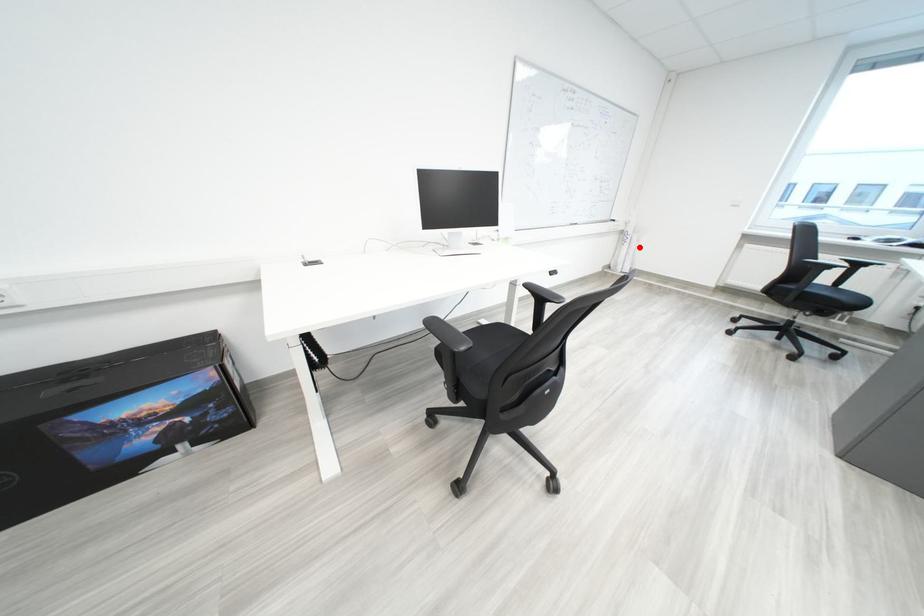
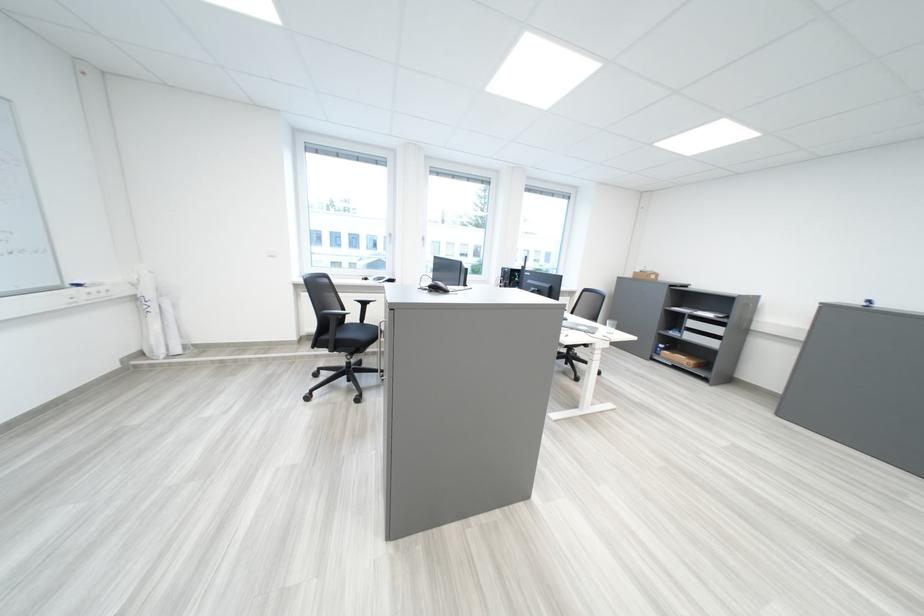
Question: I am providing you with two images of the same scene from different viewpoints. A red point is marked on the first image. Can you still see the location of the red point in image 2?

Choices:
 (A) Yes
 (B) No

Answer: (A)